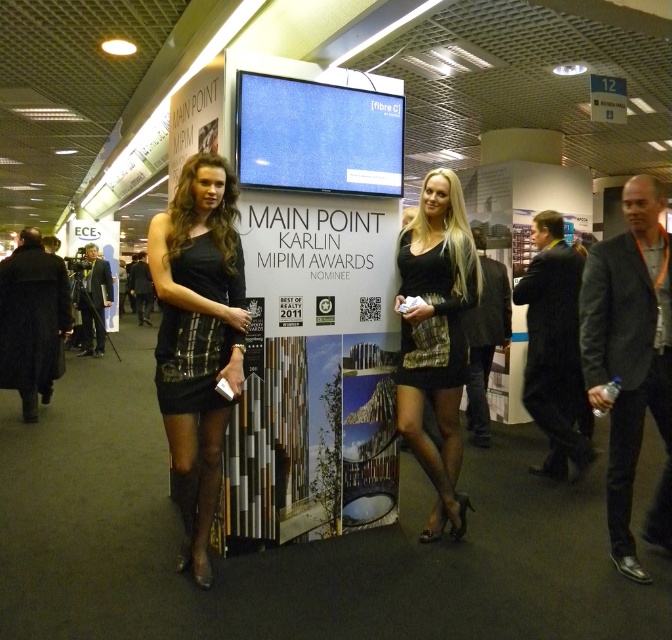
Does point (417, 456) lie behind point (171, 326)?

Yes, it is behind point (171, 326).

Does shiny black dress at center have a lesser width compared to black plaid dress at left?

No, shiny black dress at center is not thinner than black plaid dress at left.

Which is in front, point (460, 336) or point (209, 356)?

Positioned in front is point (209, 356).

Find the location of `shiny black dress at center`. shiny black dress at center is located at coordinates (435, 339).

From the picture: Is black plaid dress at left bigger than black plaid dress at center?

No.

At what (x,y) coordinates should I click in order to perform the action: click on black plaid dress at left. Please return your answer as a coordinate pair (x, y). The image size is (672, 640). Looking at the image, I should click on (190, 358).

This screenshot has width=672, height=640. Identify the location of black plaid dress at left. (190, 358).

Does black satin dress at center have a greater width compared to shiny black dress at center?

Yes, black satin dress at center is wider than shiny black dress at center.

Between black satin dress at center and shiny black dress at center, which one has less height?

With less height is shiny black dress at center.

Does point (208, 154) come in front of point (446, 360)?

That is True.

The image size is (672, 640). Identify the location of black satin dress at center. (198, 339).